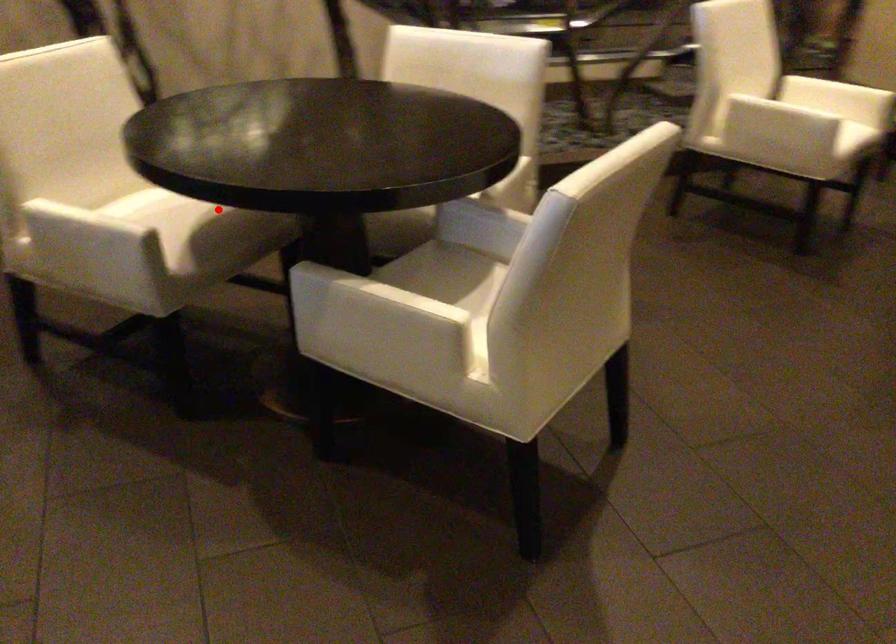
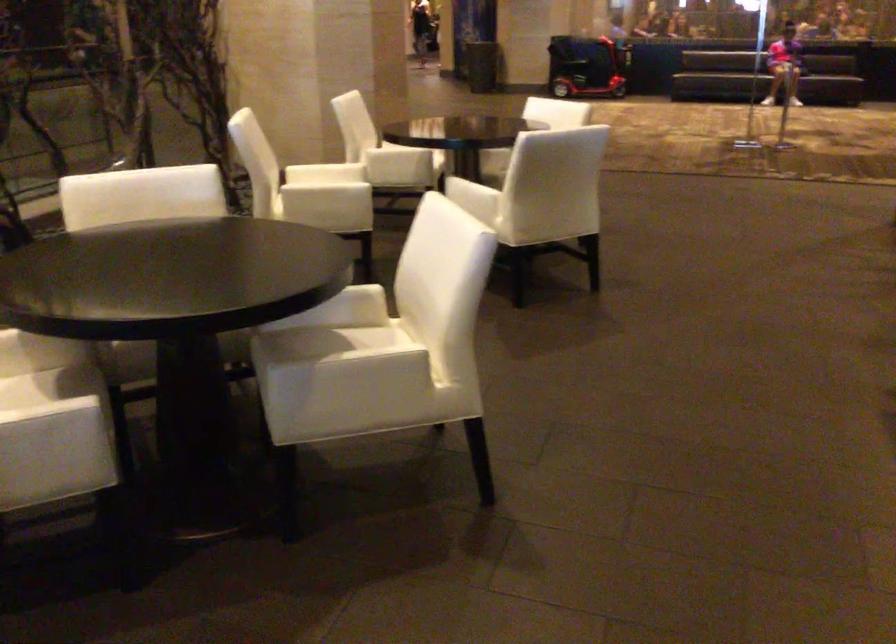
Find the pixel in the second image that matches the highlighted location in the first image.

(46, 383)